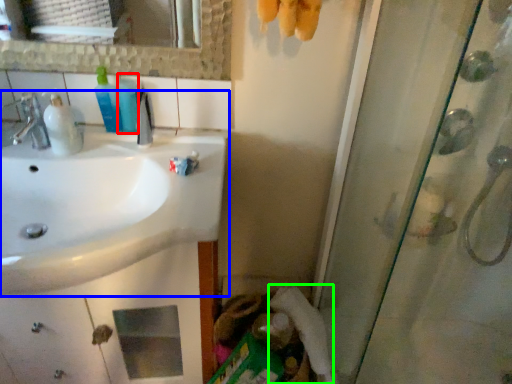
Question: Which is nearer to the mouthwash (highlighted by a red box)? sink (highlighted by a blue box) or toilet paper (highlighted by a green box).

Choices:
 (A) sink
 (B) toilet paper

Answer: (A)